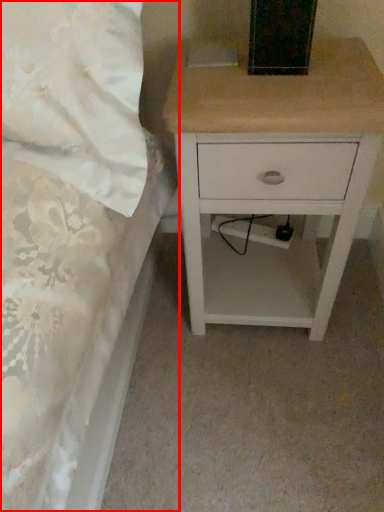
Question: Considering the relative positions of bed (annotated by the red box) and nightstand in the image provided, where is bed (annotated by the red box) located with respect to the staircase?

Choices:
 (A) right
 (B) left

Answer: (B)